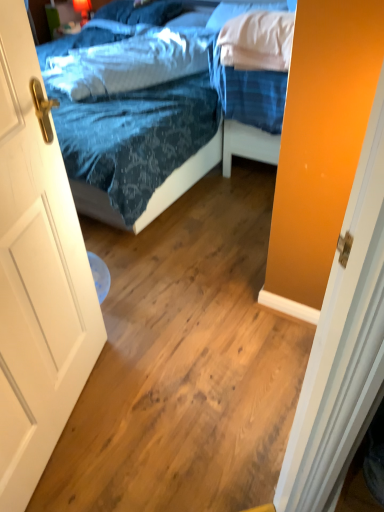
At what (x,y) coordinates should I click in order to perform the action: click on vacant space in blue fabric bed at upper right (from a real-world perspective). Please return your answer as a coordinate pair (x, y). Looking at the image, I should click on (250, 180).